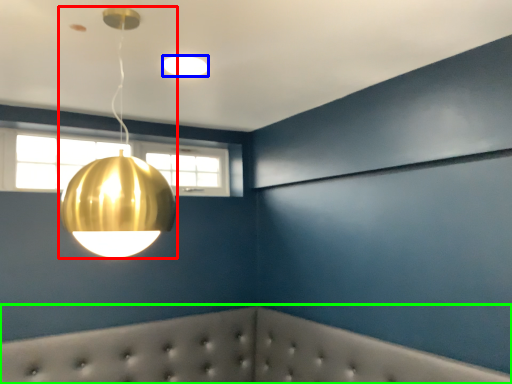
Question: Estimate the real-world distances between objects in this image. Which object is closer to lamp (highlighted by a red box), lamp (highlighted by a blue box) or furniture (highlighted by a green box)?

Choices:
 (A) lamp
 (B) furniture

Answer: (A)